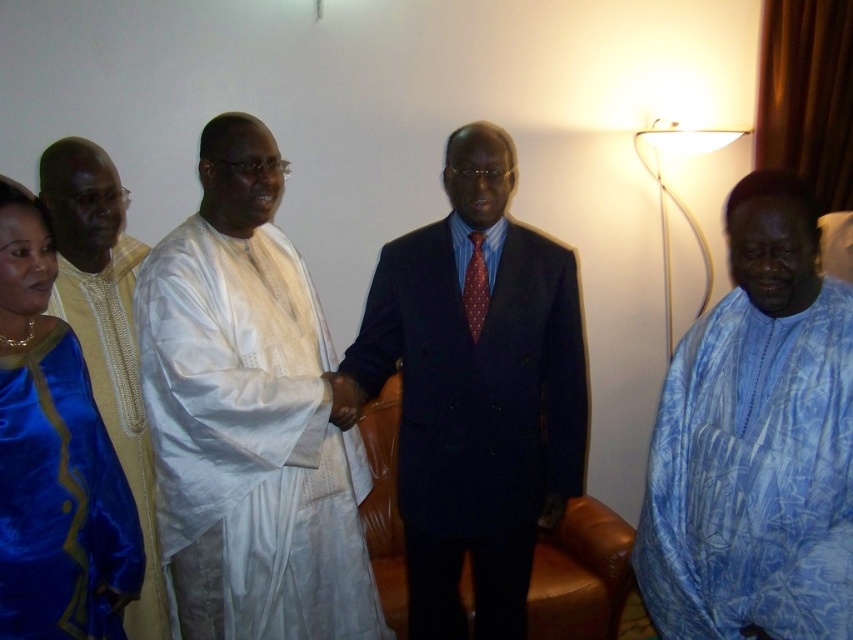
You are a photographer at a formal event. You need to capture a photo of the white cloth at center and the dark blue suit at center. According to the scene, which object is located to the left of the other?

The white cloth at center is positioned on the left side of dark blue suit at center, so the white cloth at center is to the left of the dark blue suit at center.

You are a photographer at a formal event. You need to capture a photo of the blue printed fabric shirt at right and the satin blue dress at left. Based on their positions, which one is higher in the frame?

The blue printed fabric shirt at right is above the satin blue dress at left, so it is higher in the frame.

You are organizing a tablecloth for a dinner event and need to decide which item to use. The white cloth at center and the blue printed fabric shirt at right are available. Based on their sizes, which one is more suitable for covering a standard rectangular table?

The white cloth at center is wider than the blue printed fabric shirt at right, making it more suitable for covering a standard rectangular table.